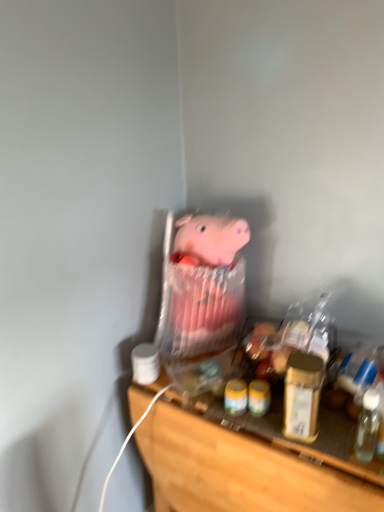
The width and height of the screenshot is (384, 512). What are the coordinates of `vacant space situated on the left part of transparent plastic bottle at right` in the screenshot? It's located at (309, 442).